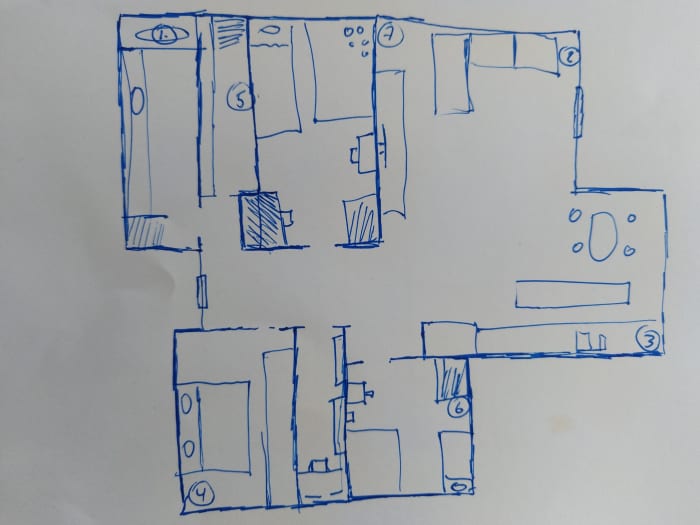
The height and width of the screenshot is (525, 700). In order to click on refridgerator in this screenshot , I will do `click(449, 335)`.